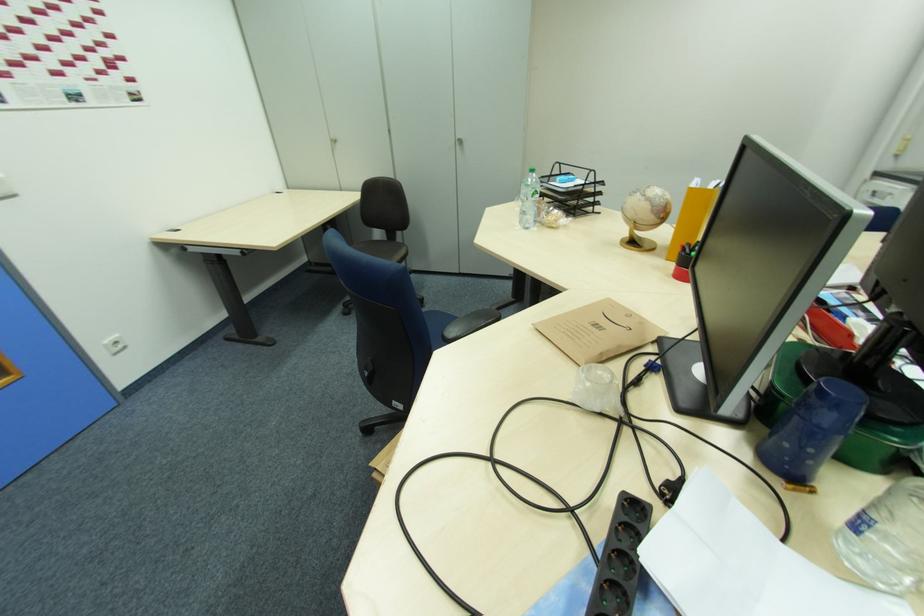
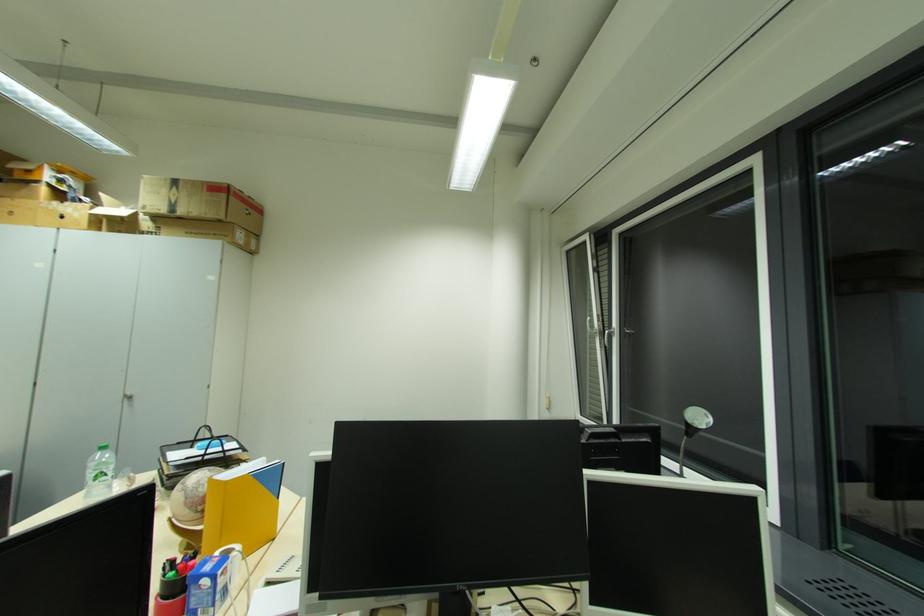
In the second image, find the point that corresponds to (563,179) in the first image.

(202, 445)